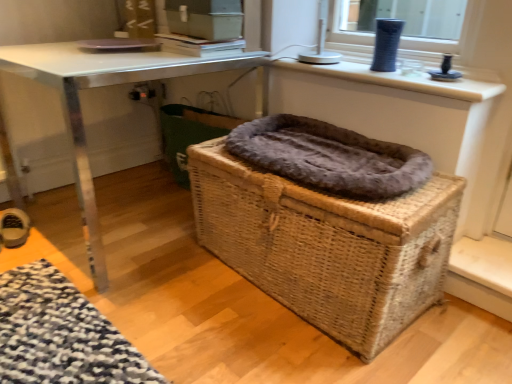
Where is `vacant space that is to the left of fuzzy brown laundry basket at center`? The width and height of the screenshot is (512, 384). vacant space that is to the left of fuzzy brown laundry basket at center is located at coordinates (136, 196).